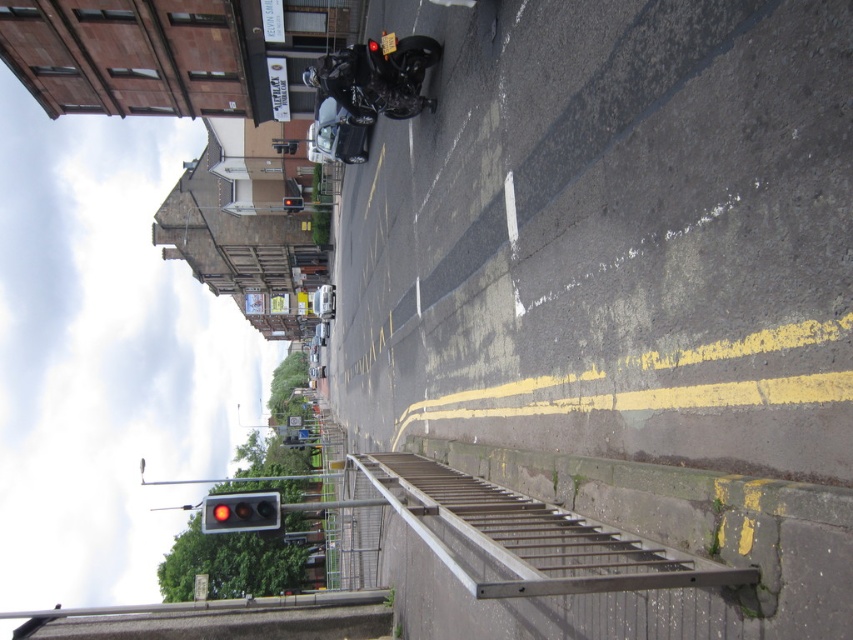
Question: Which of the following is the closest to the observer?

Choices:
 (A) red glass traffic light at lower left
 (B) red glass traffic light at center

Answer: (A)

Question: Is red glass traffic light at lower left thinner than red glass traffic light at center?

Choices:
 (A) no
 (B) yes

Answer: (A)

Question: Can you confirm if red glass traffic light at lower left is positioned to the left of red glass traffic light at center?

Choices:
 (A) no
 (B) yes

Answer: (A)

Question: Can you confirm if red glass traffic light at lower left is smaller than red glass traffic light at center?

Choices:
 (A) yes
 (B) no

Answer: (B)